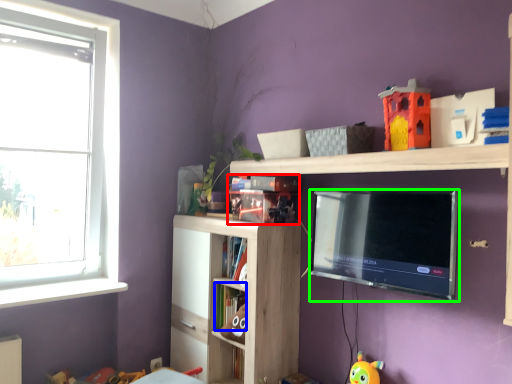
Question: Considering the real-world distances, which object is farthest from book (highlighted by a red box)? book (highlighted by a blue box) or television (highlighted by a green box)?

Choices:
 (A) book
 (B) television

Answer: (A)